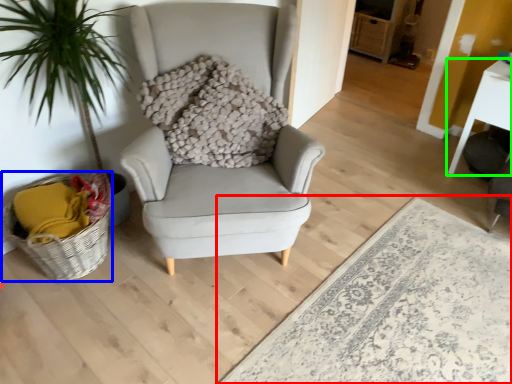
Question: Based on their relative distances, which object is nearer to plain (highlighted by a red box)? Choose from basket (highlighted by a blue box) and table (highlighted by a green box).

Choices:
 (A) basket
 (B) table

Answer: (B)